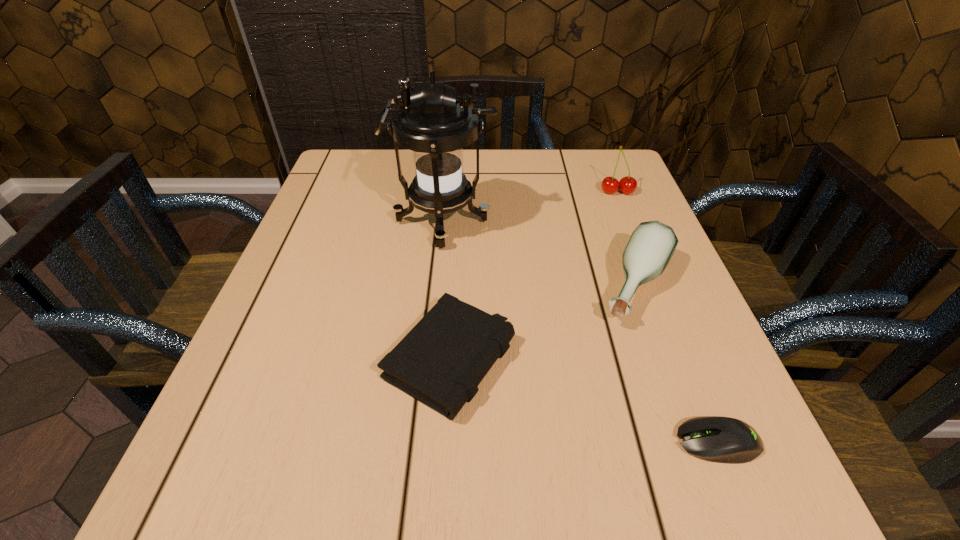
Find the location of a particular element. This screenshot has width=960, height=540. free space located on the wheel side of the shortest object is located at coordinates (565, 442).

Locate an element on the screen. This screenshot has width=960, height=540. vacant space located 0.130m on the wheel side of the shortest object is located at coordinates (587, 442).

Where is `lantern that is positioned at the far edge`? The image size is (960, 540). lantern that is positioned at the far edge is located at coordinates (436, 125).

You are a GUI agent. You are given a task and a screenshot of the screen. Output one action in this format:
    pyautogui.click(x=<x>, y=<y>)
    Task: Click on the cherry that is at the far edge
    The width and height of the screenshot is (960, 540).
    Given the screenshot: What is the action you would take?
    pyautogui.click(x=627, y=185)

This screenshot has height=540, width=960. Find the location of `object that is positioned at the near edge`. object that is positioned at the near edge is located at coordinates (718, 439).

At what (x,y) coordinates should I click in order to perform the action: click on cherry positioned at the right edge. Please return your answer as a coordinate pair (x, y). This screenshot has height=540, width=960. Looking at the image, I should click on (627, 185).

Locate an element on the screen. This screenshot has height=540, width=960. bottle present at the right edge is located at coordinates (648, 251).

Find the location of a particular element. Image resolution: width=960 pixels, height=540 pixels. computer mouse positioned at the right edge is located at coordinates (718, 439).

What are the coordinates of `object at the far right corner` in the screenshot? It's located at (627, 185).

Find the location of a particular element. object present at the near right corner is located at coordinates (718, 439).